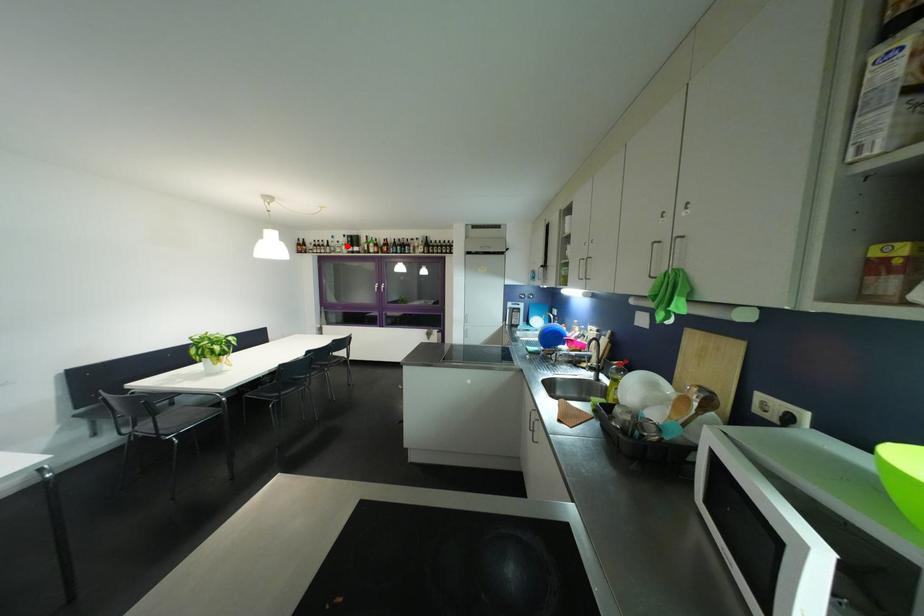
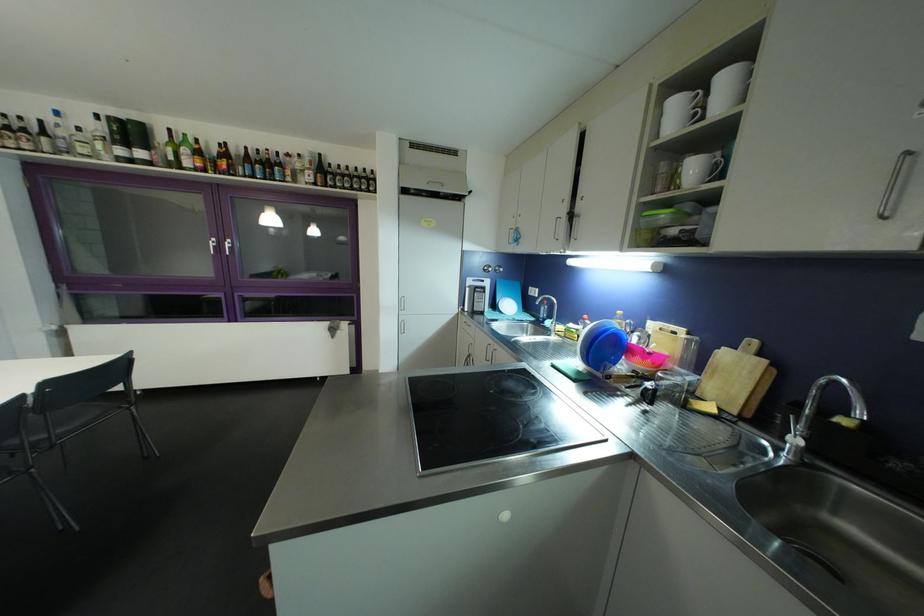
In the second image, find the point that corresponds to the highlighted location in the first image.

(94, 137)